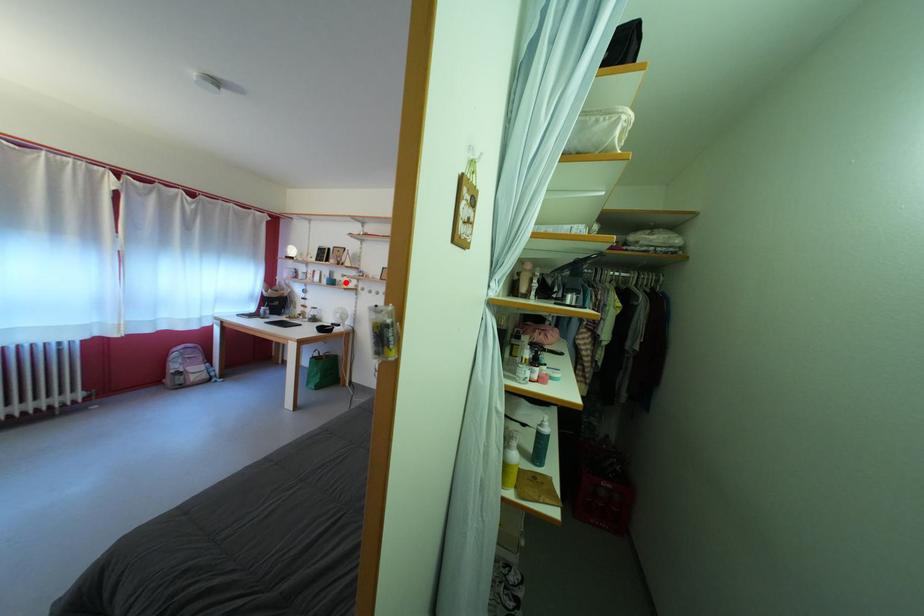
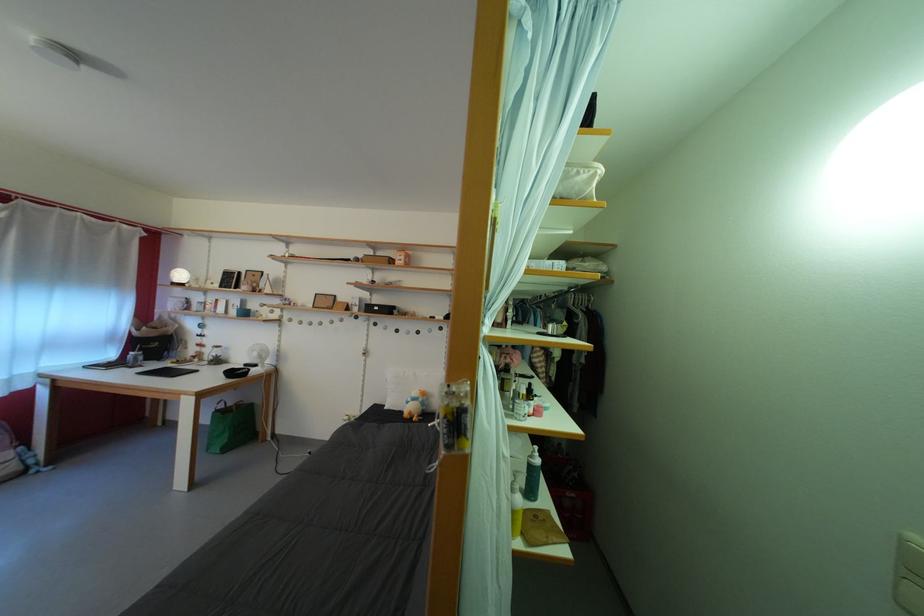
Where in the second image is the point corresponding to the highlighted location from the first image?

(261, 312)